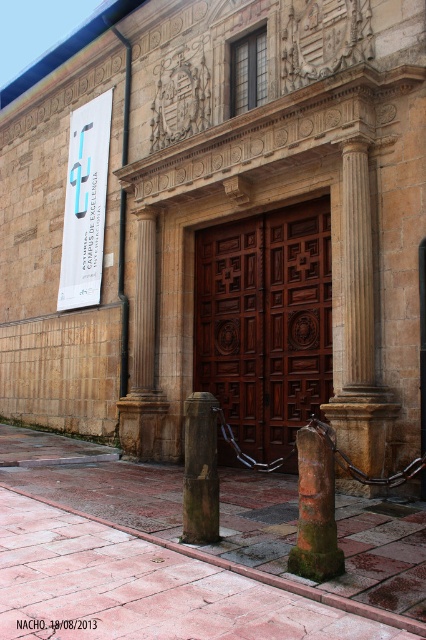
Question: Does wooden at center come behind rusty stone pillar at lower center?

Choices:
 (A) no
 (B) yes

Answer: (B)

Question: From the image, what is the correct spatial relationship of wooden at center in relation to stone column at center?

Choices:
 (A) left
 (B) right

Answer: (A)

Question: Does stone column at center have a greater width compared to rusty stone pillar at lower center?

Choices:
 (A) yes
 (B) no

Answer: (A)

Question: Which point appears closest to the camera in this image?

Choices:
 (A) (207, 541)
 (B) (363, 301)
 (C) (319, 536)
 (D) (245, 417)

Answer: (C)

Question: Among these points, which one is nearest to the camera?

Choices:
 (A) (299, 508)
 (B) (204, 248)
 (C) (213, 538)

Answer: (A)

Question: Among these objects, which one is farthest from the camera?

Choices:
 (A) wooden at center
 (B) wooden post at center

Answer: (A)